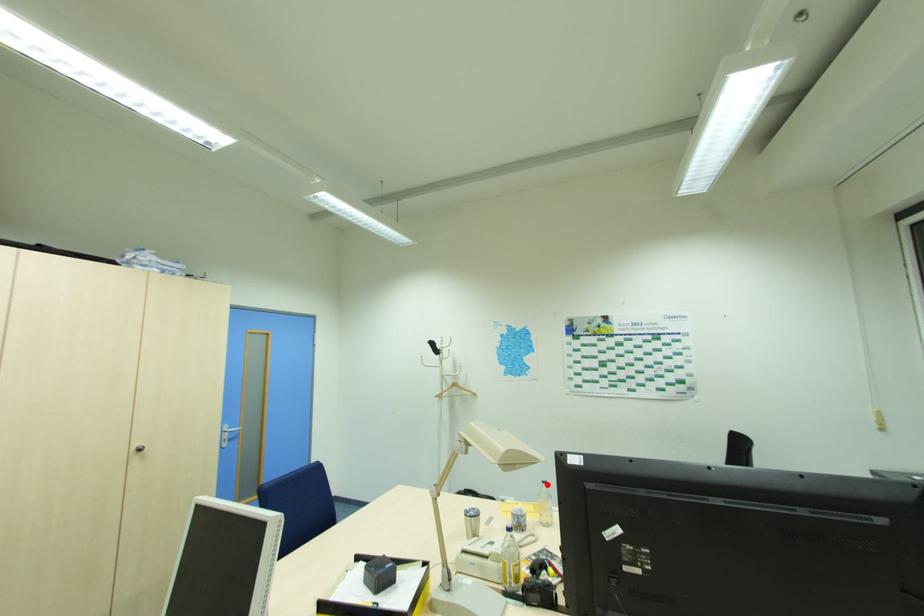
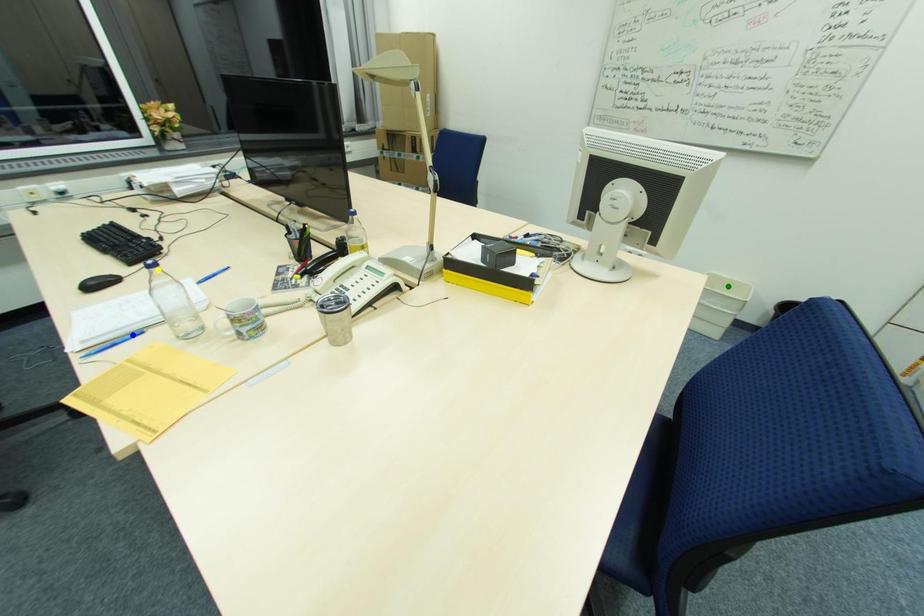
Question: I am providing you with two images of the same scene from different viewpoints. A red point is marked on the first image. You are given multiple points on the second image. Which mark in image 2 goes with the point in image 1?

Choices:
 (A) green point
 (B) yellow point
 (C) blue point

Answer: (B)